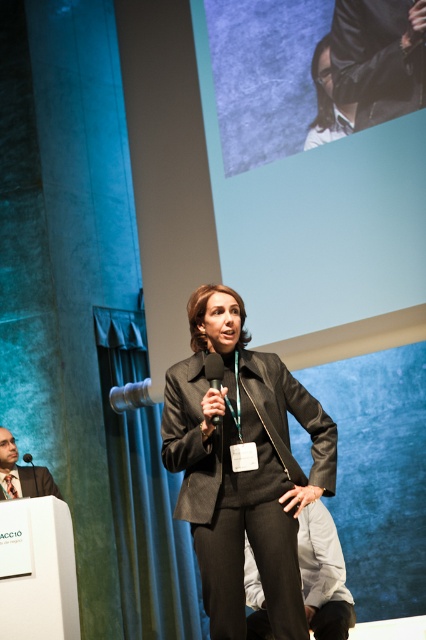
You are an event coordinator setting up a conference room. You need to place a small podium for the speaker. The podium should be positioned so that it is directly in front of the point marked at coordinates point (327, 100). Is the podium likely to block the speaker from seeing the large screen displaying the slide with two individuals?

The point (327, 100) marks the matte black jacket at upper center. Since the podium is to be placed directly in front of this point, it would likely block the speaker from seeing the large screen behind them, which is where the slide with two individuals is displayed.

You are an event organizer who needs to arrange seating for two presenters. The first presenter is wearing the matte black suit at center, and the second is wearing the dark gray suit at upper right. Based on their attire sizes, which presenter should you seat in a larger chair?

The matte black suit at center has a larger size compared to the dark gray suit at upper right, so the first presenter wearing the matte black suit at center should be seated in a larger chair.

In the professional setting described, where exactly is the dark gray suit at upper right located in terms of coordinates?

The dark gray suit at upper right is located at coordinates point (379, 58).